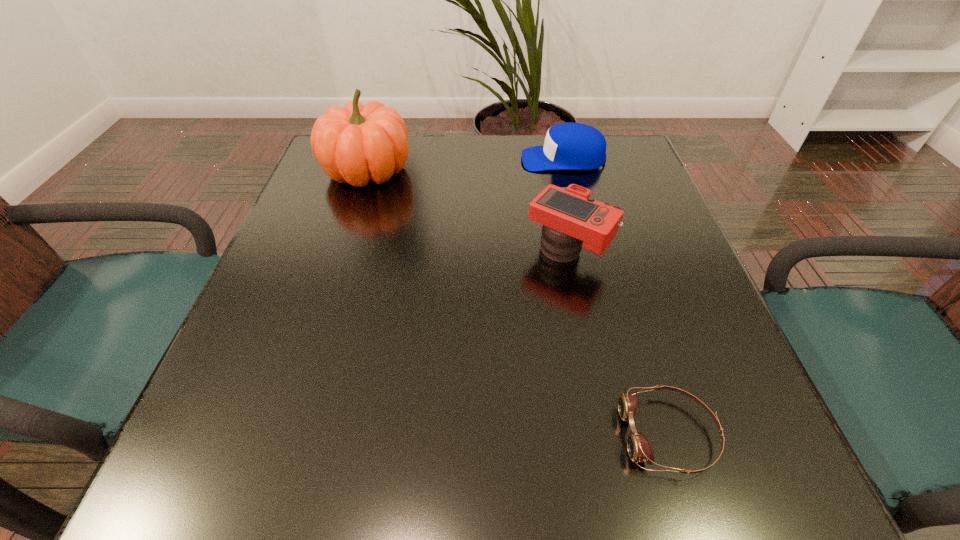
At what (x,y) coordinates should I click in order to perform the action: click on blank space at the near left corner of the desktop. Please return your answer as a coordinate pair (x, y). This screenshot has width=960, height=540. Looking at the image, I should click on (248, 435).

Find the location of `free space between the baseball cap and the shortest object`. free space between the baseball cap and the shortest object is located at coordinates (616, 296).

Locate an element on the screen. free space between the leftmost object and the nearest object is located at coordinates (518, 302).

What are the coordinates of `empty space that is in between the leftmost object and the baseball cap` in the screenshot? It's located at (465, 165).

Where is `vacant point located between the second shortest object and the goggles`? The height and width of the screenshot is (540, 960). vacant point located between the second shortest object and the goggles is located at coordinates (616, 296).

Image resolution: width=960 pixels, height=540 pixels. Find the location of `vacant space in between the third tallest object and the tallest object`. vacant space in between the third tallest object and the tallest object is located at coordinates pos(465,165).

Find the location of a particular element. empty location between the tallest object and the second tallest object is located at coordinates (468, 212).

At what (x,y) coordinates should I click in order to perform the action: click on empty space that is in between the tallest object and the camera. Please return your answer as a coordinate pair (x, y). This screenshot has width=960, height=540. Looking at the image, I should click on (468, 212).

In order to click on vacant space in between the third tallest object and the tallest object in this screenshot , I will do (465, 165).

The image size is (960, 540). Find the location of `object that is the second closest to the pumpkin`. object that is the second closest to the pumpkin is located at coordinates (572, 219).